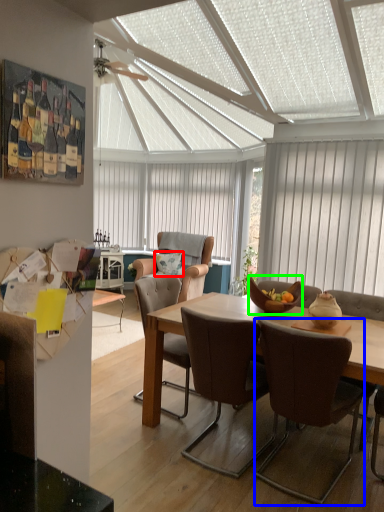
Question: Which object is positioned closest to pillow (highlighted by a red box)? Select from chair (highlighted by a blue box) and bowl (highlighted by a green box).

Choices:
 (A) chair
 (B) bowl

Answer: (B)